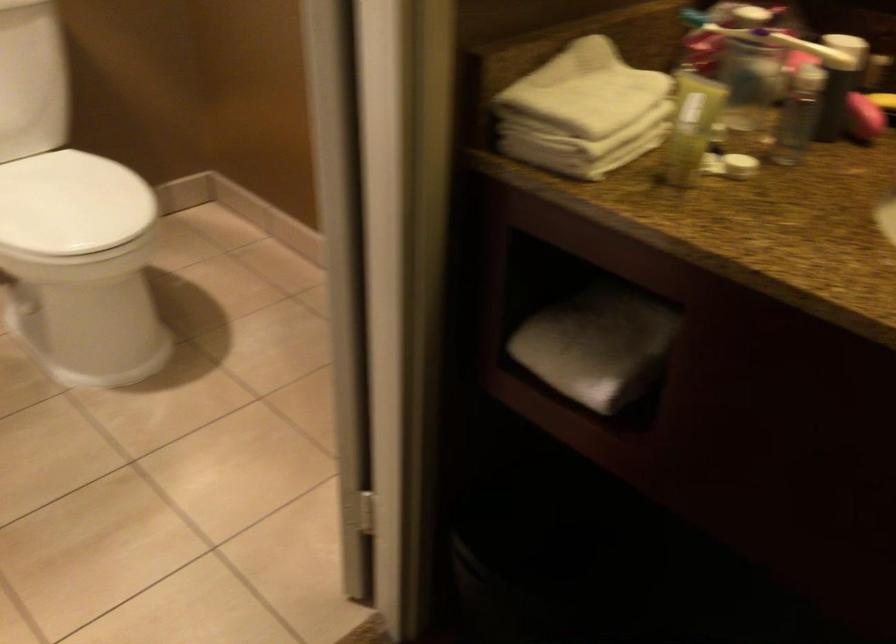
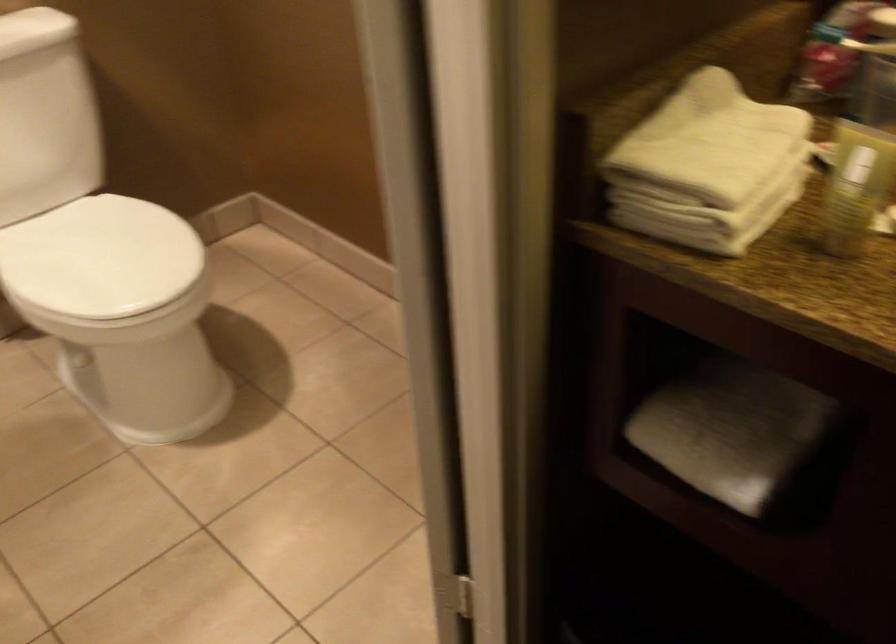
The point at (x=570, y=145) is marked in the first image. Where is the corresponding point in the second image?

(704, 219)